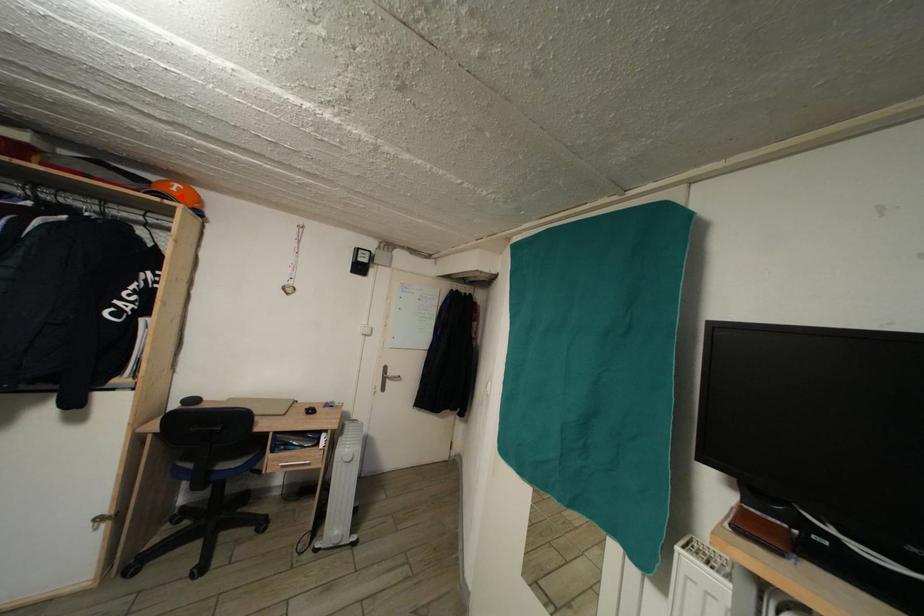
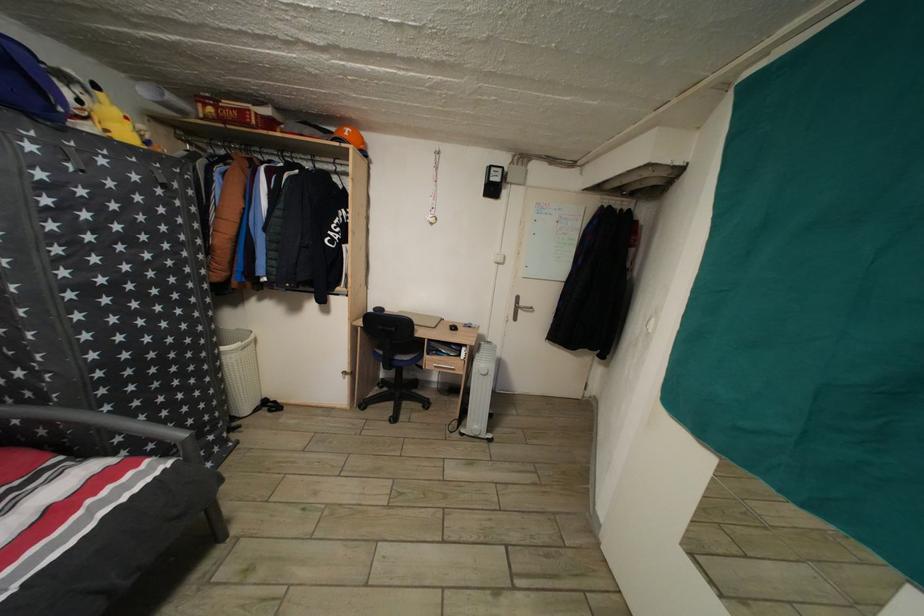
Where in the second image is the point corresponding to the highlighted location from the first image?

(354, 140)